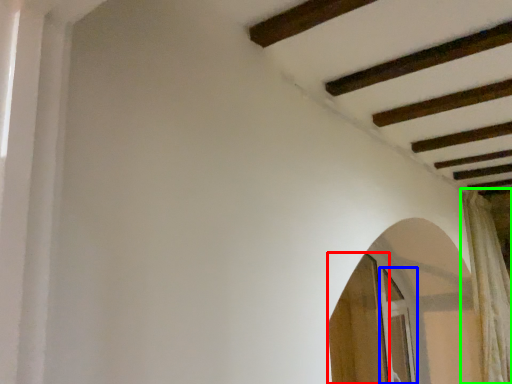
Question: Based on their relative distances, which object is nearer to screen door (highlighted by a red box)? Choose from screen door (highlighted by a blue box) and curtain (highlighted by a green box).

Choices:
 (A) screen door
 (B) curtain

Answer: (A)